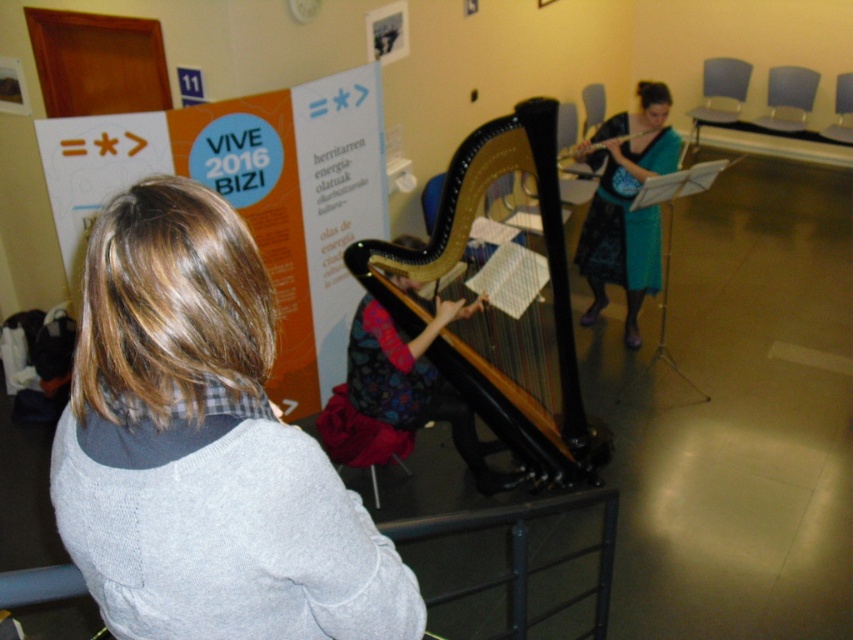
You are a photographer standing in the audience at a music recital. You want to take a closeup photo of the wooden harp at center. The camera you have can focus on objects up to 2 meters away. Will you be able to take the photo without moving closer?

The wooden harp at center is 2.75 meters from viewer, which is beyond the camera focus range of 2 meters. Therefore, you cannot take the closeup photo without moving closer.

You are a stagehand setting up for a performance. You need to ensure that the wooden harp at center is visible to the audience. Considering the height of the teal fabric skirt at center, will the harp be obscured by the skirt?

The wooden harp at center is shorter than the teal fabric skirt at center, so the skirt may obscure the harp from the audience. Adjust the harp or the skirt to ensure visibility.

You are standing at the center of the room and want to hand a gift to both the person wearing the gray knitted sweater at center and the teal fabric skirt at center. Which one should you approach first if you want to minimize the distance traveled?

You should approach the gray knitted sweater at center first because it is 3.57 meters away from the teal fabric skirt at center, so the gray knitted sweater is closer to you than the teal fabric skirt.